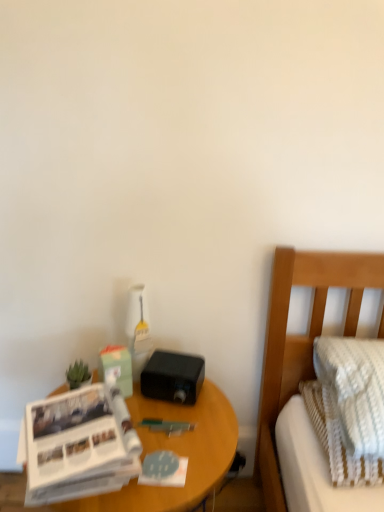
The width and height of the screenshot is (384, 512). I want to click on vacant space to the right of white paper at left, so click(180, 451).